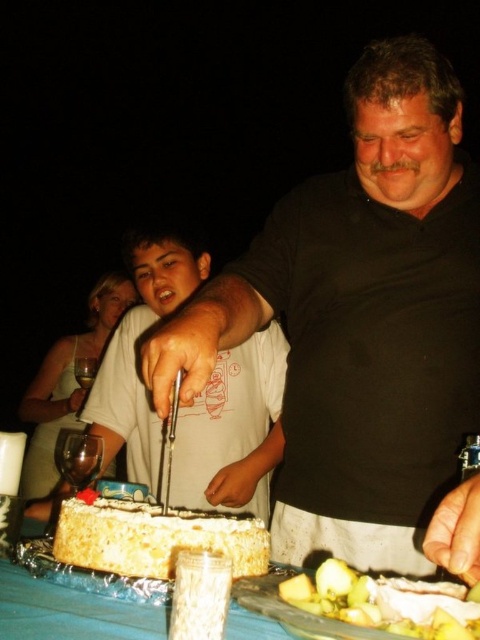
Which of these two, white frosted cake at center or transparent glass wine at left, stands taller?

Standing taller between the two is transparent glass wine at left.

Who is more distant from viewer, (129, 576) or (78, 358)?

Positioned behind is point (78, 358).

Identify the location of white frosted cake at center. (154, 538).

Which is in front, point (256, 540) or point (71, 486)?

Point (256, 540) is in front.

Does point (117, 516) lie behind point (80, 448)?

No, it is in front of (80, 448).

At what (x,y) coordinates should I click in order to perform the action: click on white frosted cake at center. Please return your answer as a coordinate pair (x, y). Looking at the image, I should click on (154, 538).

Can you confirm if black matte shirt at center is positioned to the right of green leafy salad at lower center?

Incorrect, black matte shirt at center is not on the right side of green leafy salad at lower center.

Is black matte shirt at center positioned in front of green leafy salad at lower center?

No, black matte shirt at center is behind green leafy salad at lower center.

Does point (407, 140) come behind point (420, 612)?

Yes, point (407, 140) is behind point (420, 612).

This screenshot has width=480, height=640. In order to click on black matte shirt at center in this screenshot , I will do `click(360, 320)`.